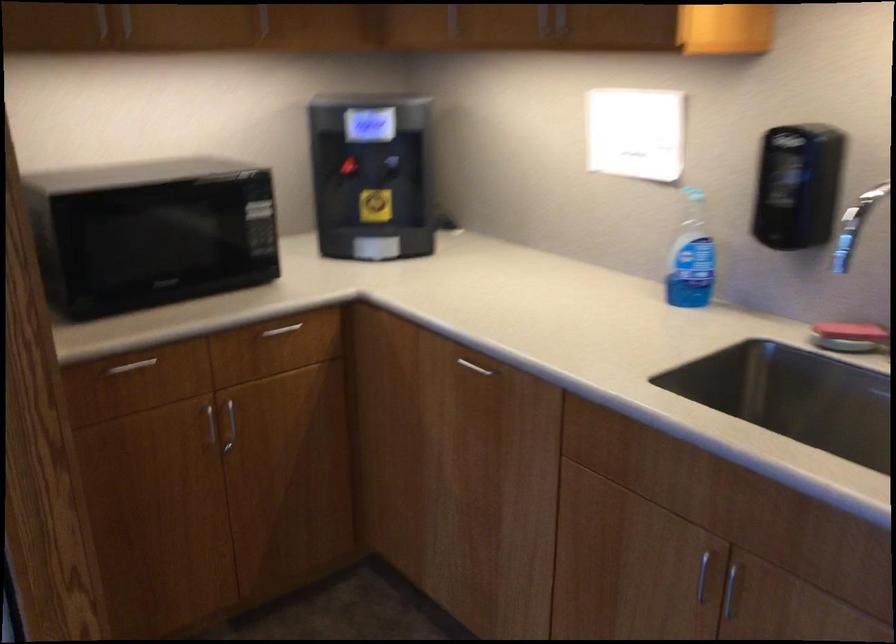
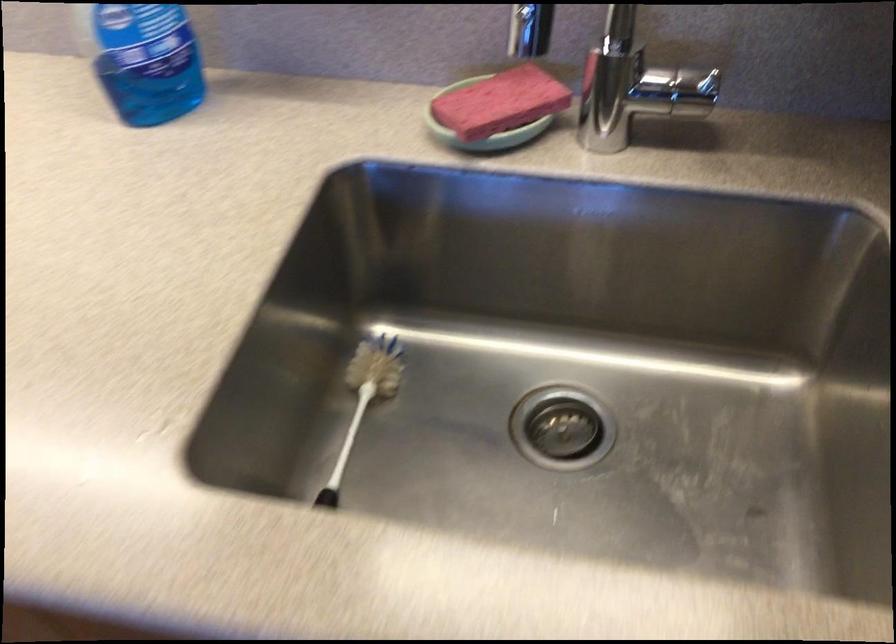
The images are taken continuously from a first-person perspective. In which direction is your viewpoint rotating?

The camera rotated toward right-down.